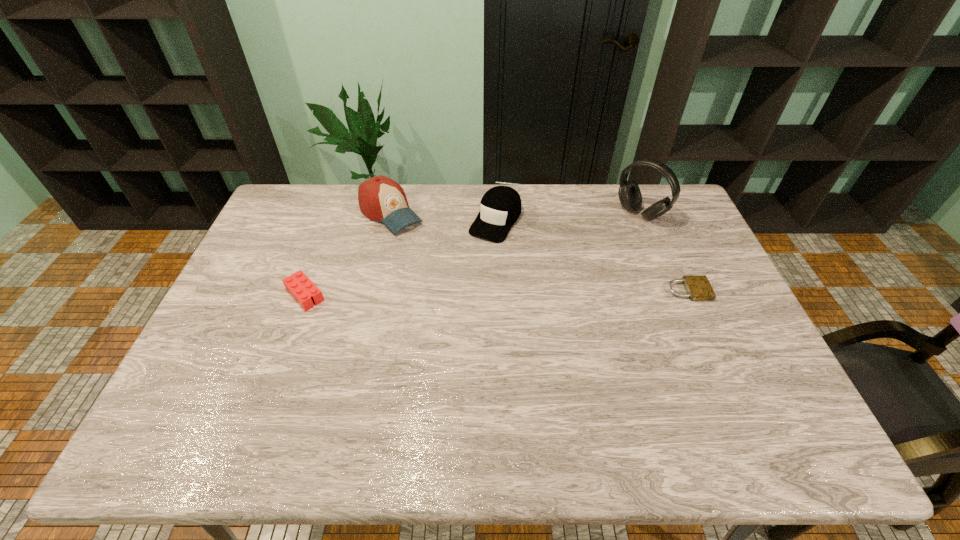
This screenshot has width=960, height=540. In order to click on free space on the desktop that is between the leftmost object and the shortest object and is positioned on the front-facing side of the baseball cap in this screenshot , I will do `click(479, 293)`.

Locate an element on the screen. Image resolution: width=960 pixels, height=540 pixels. vacant spot on the desktop that is between the leftmost object and the shortest object and is positioned on the earcups of the tallest object is located at coordinates (545, 292).

Where is `vacant spot on the desktop that is between the leftmost object and the shortest object and is positioned on the front-facing side of the third object from left to right`? vacant spot on the desktop that is between the leftmost object and the shortest object and is positioned on the front-facing side of the third object from left to right is located at coordinates (444, 293).